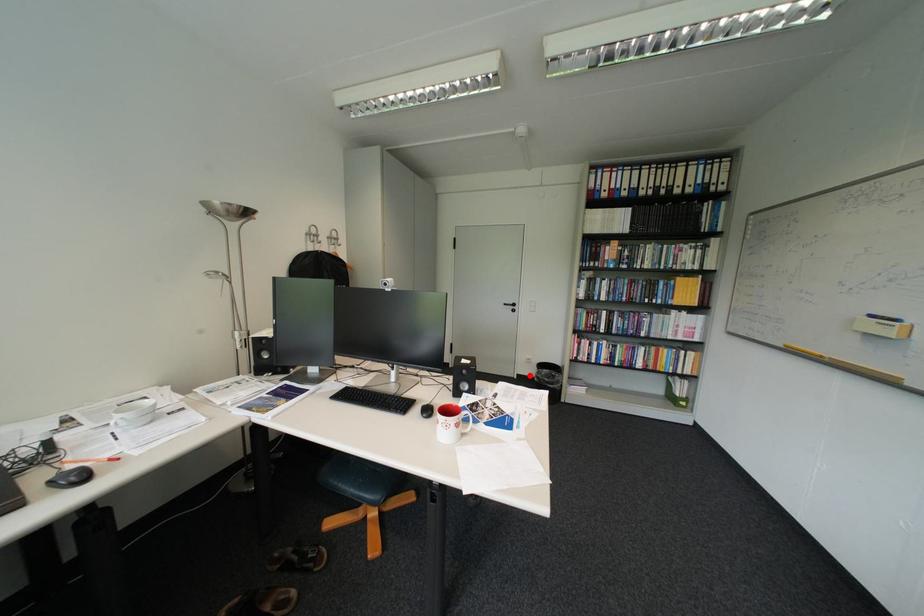
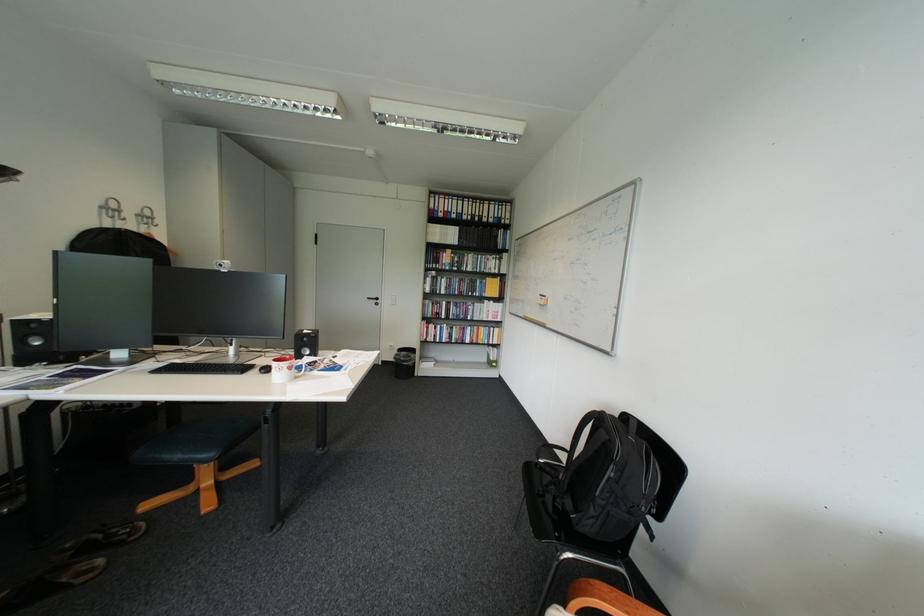
Question: I am providing you with two images of the same scene from different viewpoints. Given a red point in image1, look at the same physical point in image2. Is it:

Choices:
 (A) Closer to the viewpoint
 (B) Farther from the viewpoint

Answer: (B)